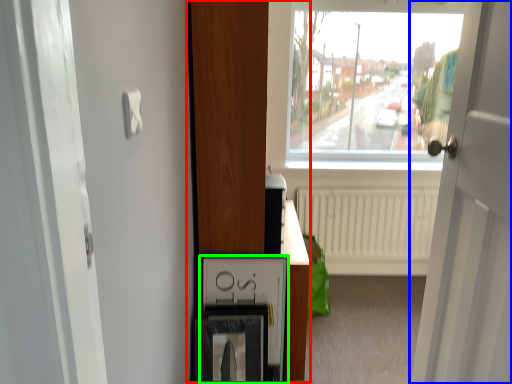
Question: Considering the real-world distances, which object is closest to dresser (highlighted by a red box)? door (highlighted by a blue box) or medicine cabinet (highlighted by a green box).

Choices:
 (A) door
 (B) medicine cabinet

Answer: (B)